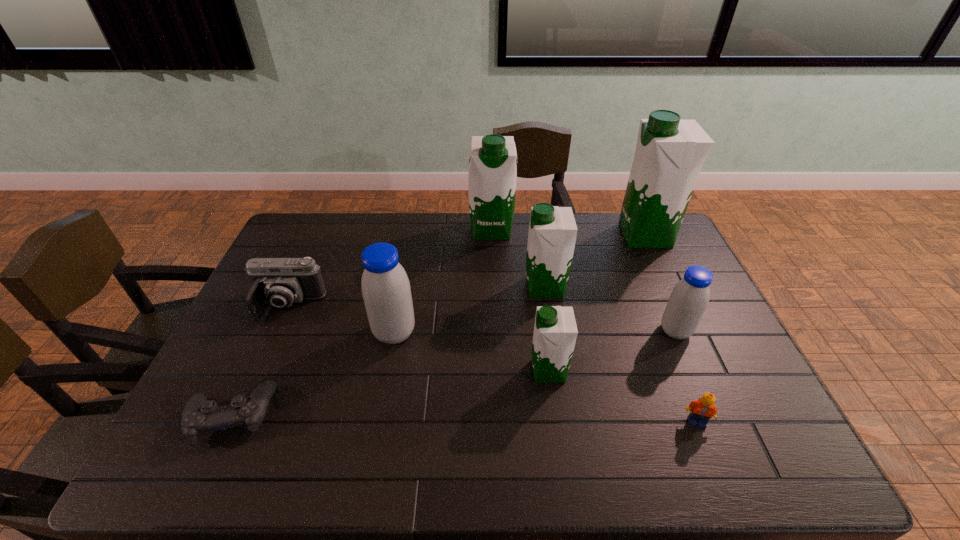
The image size is (960, 540). Find the location of `free space located 0.390m on the front-facing side of the fourth nearest soya milk`. free space located 0.390m on the front-facing side of the fourth nearest soya milk is located at coordinates (402, 287).

Where is `vacant region located on the front-facing side of the fourth nearest soya milk`? vacant region located on the front-facing side of the fourth nearest soya milk is located at coordinates (434, 287).

This screenshot has width=960, height=540. I want to click on blank area located 0.350m on the front-facing side of the fourth nearest soya milk, so pyautogui.click(x=415, y=287).

Identify the location of free location located on the right of the left blue soya milk. Image resolution: width=960 pixels, height=540 pixels. (482, 333).

I want to click on free space located 0.170m on the front-facing side of the nearest green soya milk, so click(x=466, y=371).

Identify the location of vacant space located on the front-facing side of the nearest green soya milk. This screenshot has height=540, width=960. (462, 371).

Locate an element on the screen. free space located 0.340m on the front-facing side of the nearest green soya milk is located at coordinates (402, 371).

This screenshot has height=540, width=960. I want to click on vacant region located on the right of the smaller blue soya milk, so click(x=726, y=331).

Identify the location of free region located at the front of the seventh tallest object with an open lens cover. The image size is (960, 540). (242, 409).

Identify the location of free space located on the right of the shortest object. (318, 414).